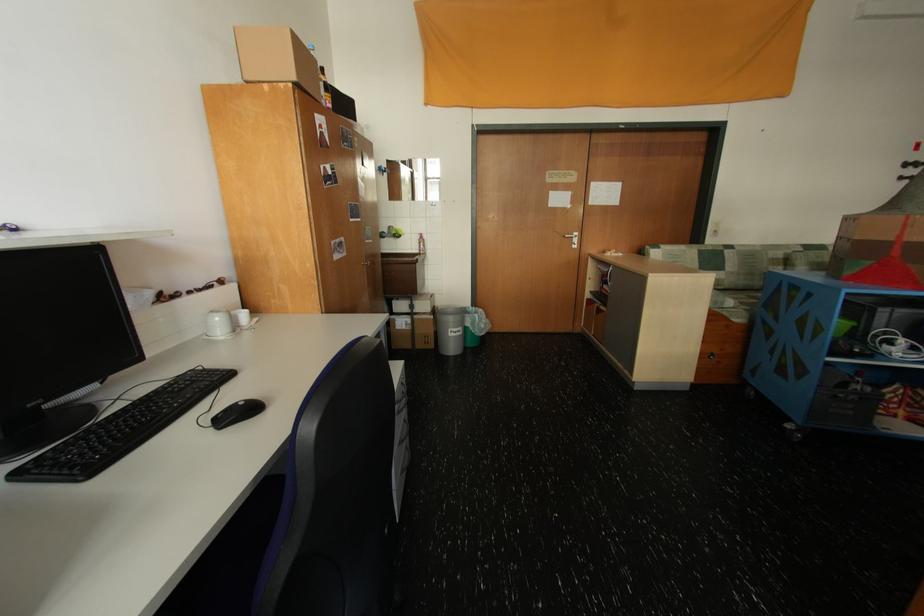
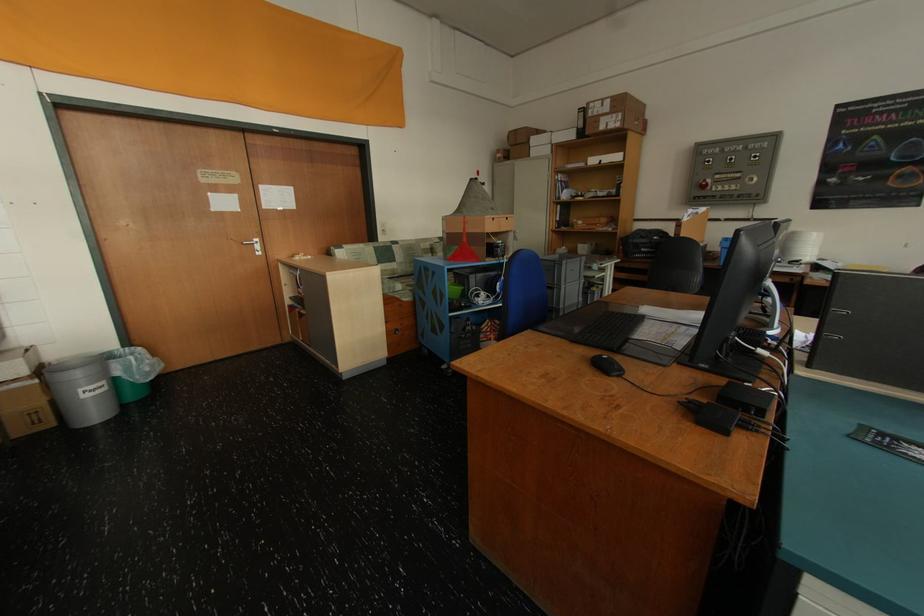
Find the pixel in the second image that matches point 430,302 in the first image.

(10, 363)